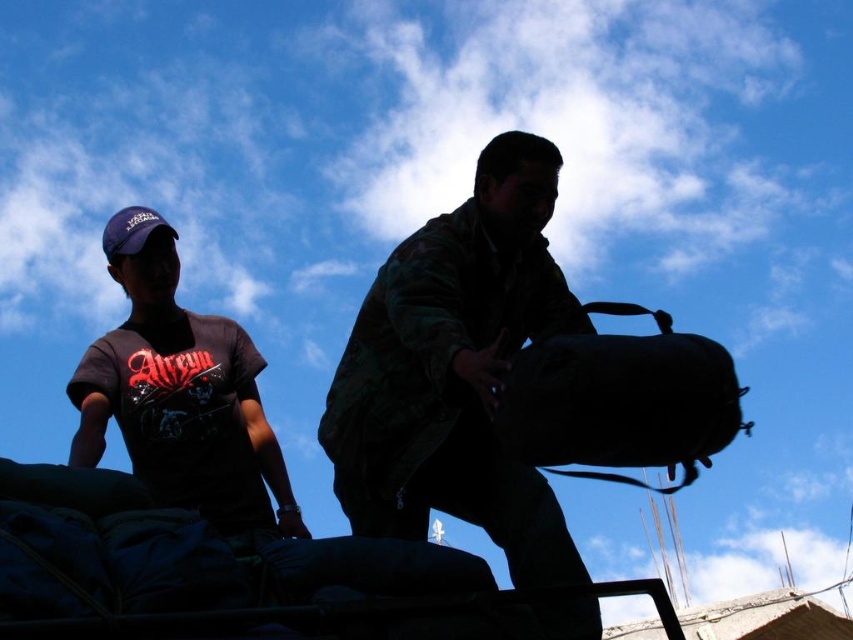
You are standing at the location of the dark camouflage jacket at upper center and want to throw a ball to someone standing at the black fabric bag at right. If the maximum throwing distance you can achieve is 20 meters, will you be able to reach them?

The dark camouflage jacket at upper center is 23.83 meters away from the black fabric bag at right. Since your maximum throwing distance is 20 meters, you will not be able to reach them.

Based on the scene description, can you identify the object located at the coordinate point (221, 432)?

The dark camouflage jacket at upper center is located at point (221, 432).

You are a photographer trying to capture a photo of the dark camouflage jacket at upper center and the black fabric bag at right. Based on their positions, which object should you focus on first to ensure both are in frame without moving the camera?

The dark camouflage jacket at upper center is below the black fabric bag at right, so you should focus on the black fabric bag at right first to ensure both are in frame without moving the camera.